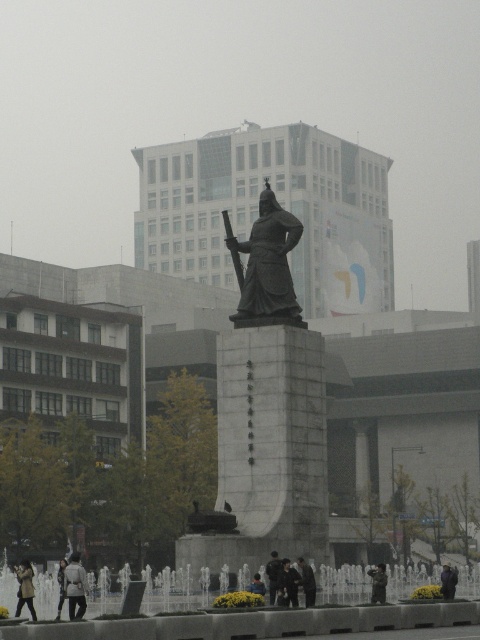
You are a delivery person standing at the edge of the square and need to deliver a package to a person wearing a light gray coat at center and another to someone wearing a dark blue fabric jacket at center. The delivery robot you are using has a maximum range of 15 meters. Can you deliver both packages without moving your position?

The light gray coat at center and dark blue fabric jacket at center are 14.54 meters apart from each other. Since the delivery robot has a maximum range of 15 meters, both recipients are within the robot delivery range. Therefore, you can deliver both packages without moving your position.

You are standing in the public square and want to take a photo of the statue. You notice two points marked on the ground at coordinates point (72,568) and point (453,584). Which point is closer to the statue?

Point (72,568) is in front of point (453,584), so it is closer to the statue.

You are a photographer standing in the public square. You want to capture both the light gray jacket at lower left and the dark gray suit at center in a single frame. Which object should you focus on first to ensure both are in the frame?

The light gray jacket at lower left has a greater width than the dark gray suit at center. To ensure both are in the frame, focus on the wider object first, which is the light gray jacket at lower left.